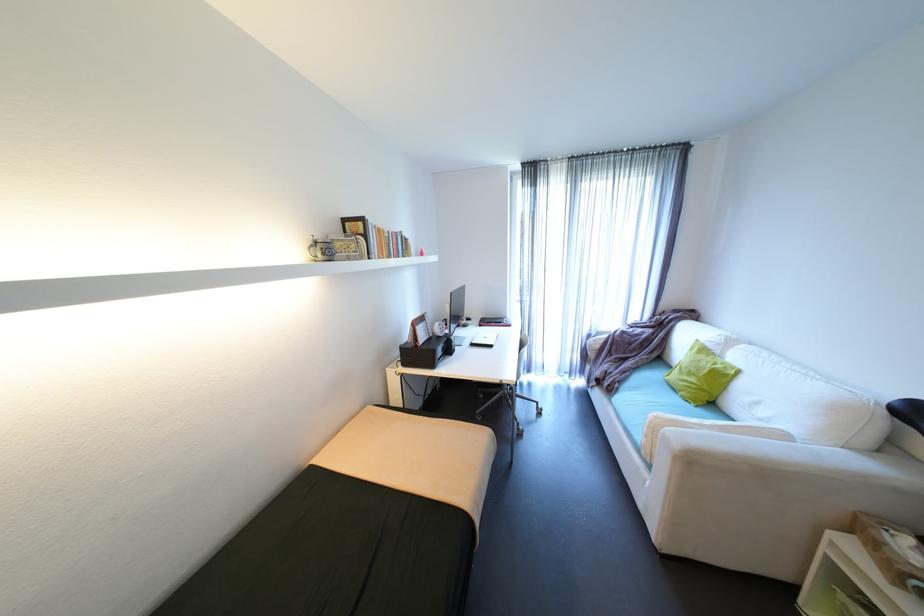
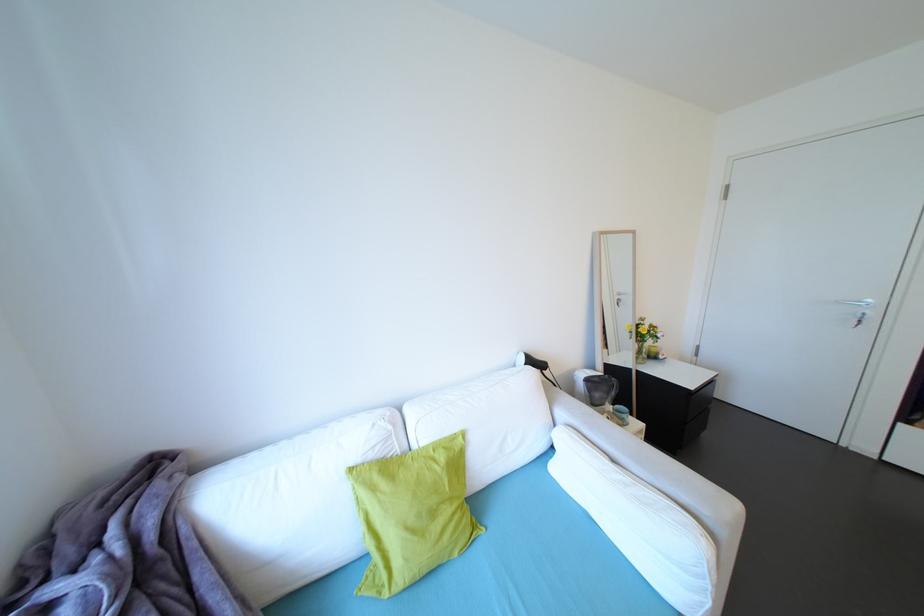
Locate, in the second image, the point that corresponds to pixel 734 368 in the first image.

(451, 448)